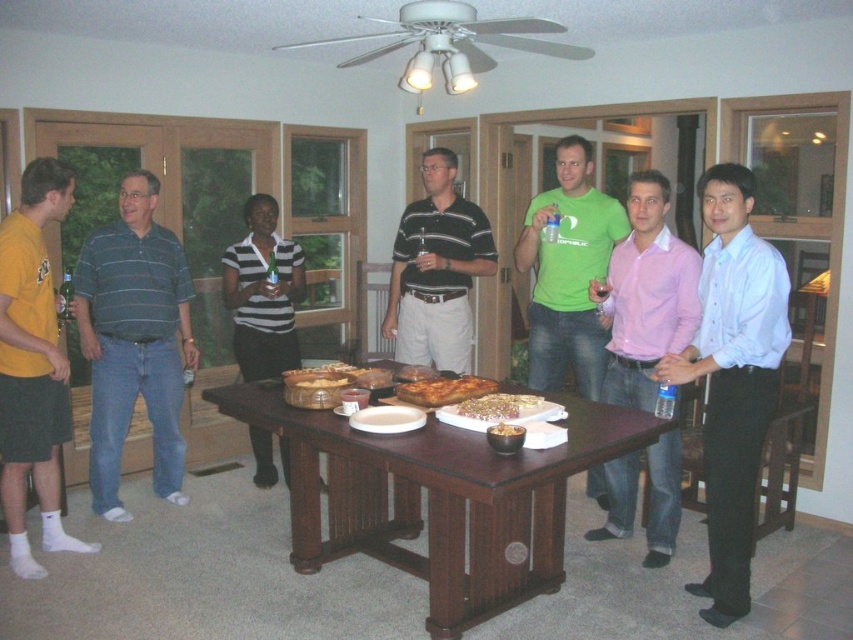
You are a guest at this gathering and want to place a napkin on the table. The napkin is 12 inches wide. Can you fit it between the golden crispy bread at center and the white glossy plate at center without overlapping either?

The golden crispy bread at center might be wider than the white glossy plate at center. Since the napkin is 12 inches wide, it depends on the actual width of the bread and plate. However, since the description states the bread might be wider, there might not be enough space. Therefore, it might not fit without overlapping.